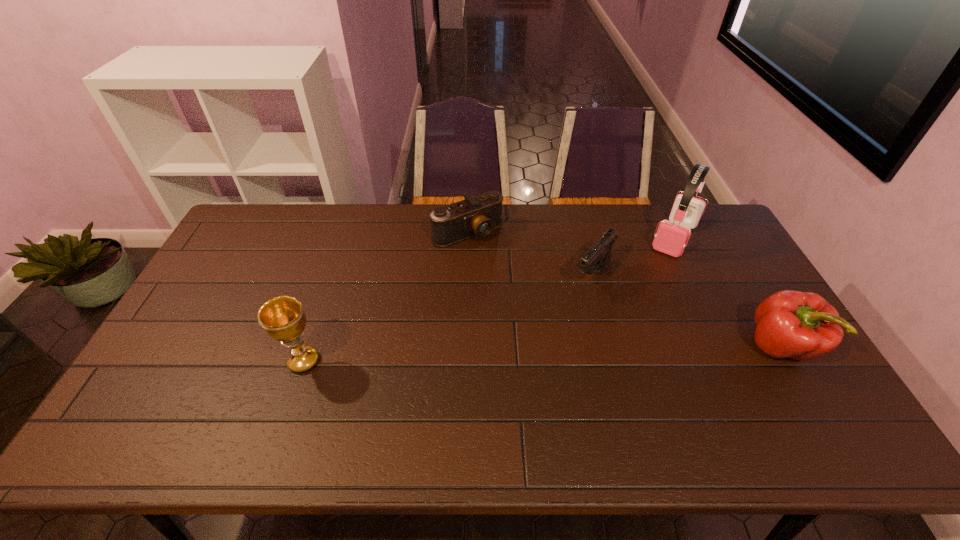
At what (x,y) coordinates should I click in order to perform the action: click on the leftmost object. Please return your answer as a coordinate pair (x, y). Looking at the image, I should click on point(283,318).

Where is `pepper`? pepper is located at coordinates (790, 324).

What are the coordinates of `pistol` in the screenshot? It's located at (597, 259).

The image size is (960, 540). I want to click on the tallest object, so click(x=671, y=238).

At what (x,y) coordinates should I click in order to perform the action: click on the shortest object. Please return your answer as a coordinate pair (x, y). The height and width of the screenshot is (540, 960). Looking at the image, I should click on (478, 216).

Locate an element on the screen. This screenshot has height=540, width=960. camera is located at coordinates (478, 216).

The height and width of the screenshot is (540, 960). Find the location of `vacant region located on the back of the chalice`. vacant region located on the back of the chalice is located at coordinates (325, 295).

Where is `vacant area situated 0.100m on the front of the pepper`? The height and width of the screenshot is (540, 960). vacant area situated 0.100m on the front of the pepper is located at coordinates (818, 410).

At what (x,y) coordinates should I click in order to perform the action: click on vacant space located 0.050m at the barrel of the pistol. Please return your answer as a coordinate pair (x, y). The height and width of the screenshot is (540, 960). Looking at the image, I should click on (573, 303).

Locate an element on the screen. free location located at the barrel of the pistol is located at coordinates (505, 382).